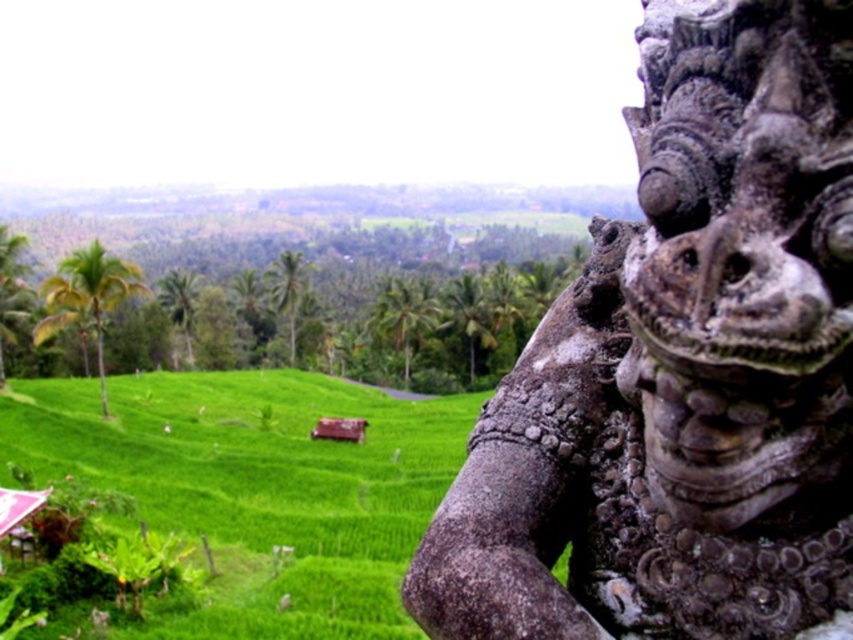
Question: Observing the image, what is the correct spatial positioning of gray stone statue at right in reference to green grassy hillside at lower left?

Choices:
 (A) left
 (B) right

Answer: (B)

Question: Which object appears closest to the camera in this image?

Choices:
 (A) green grassy hillside at lower left
 (B) gray stone statue at right

Answer: (B)

Question: Does gray stone statue at right appear on the right side of green grassy hillside at lower left?

Choices:
 (A) yes
 (B) no

Answer: (A)

Question: Which point is closer to the camera?

Choices:
 (A) green grassy hillside at lower left
 (B) gray stone statue at right

Answer: (B)

Question: Is gray stone statue at right closer to camera compared to green grassy hillside at lower left?

Choices:
 (A) yes
 (B) no

Answer: (A)